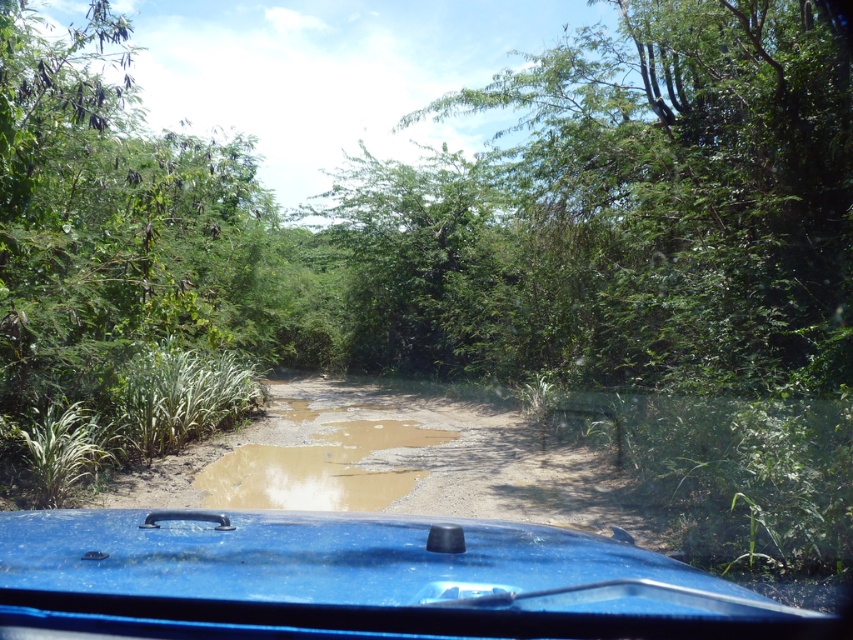
Question: Is glossy blue car at center thinner than brown muddy puddle at center?

Choices:
 (A) no
 (B) yes

Answer: (A)

Question: Can you confirm if glossy blue car at center is wider than brown muddy puddle at center?

Choices:
 (A) yes
 (B) no

Answer: (A)

Question: Which of the following is the closest to the observer?

Choices:
 (A) (376, 509)
 (B) (747, 620)

Answer: (B)

Question: Which point appears farthest from the camera in this image?

Choices:
 (A) (219, 552)
 (B) (308, 467)

Answer: (B)

Question: Can you confirm if glossy blue car at center is positioned to the right of brown muddy puddle at center?

Choices:
 (A) no
 (B) yes

Answer: (B)

Question: Which object is farther from the camera taking this photo?

Choices:
 (A) glossy blue car at center
 (B) brown muddy puddle at center

Answer: (B)